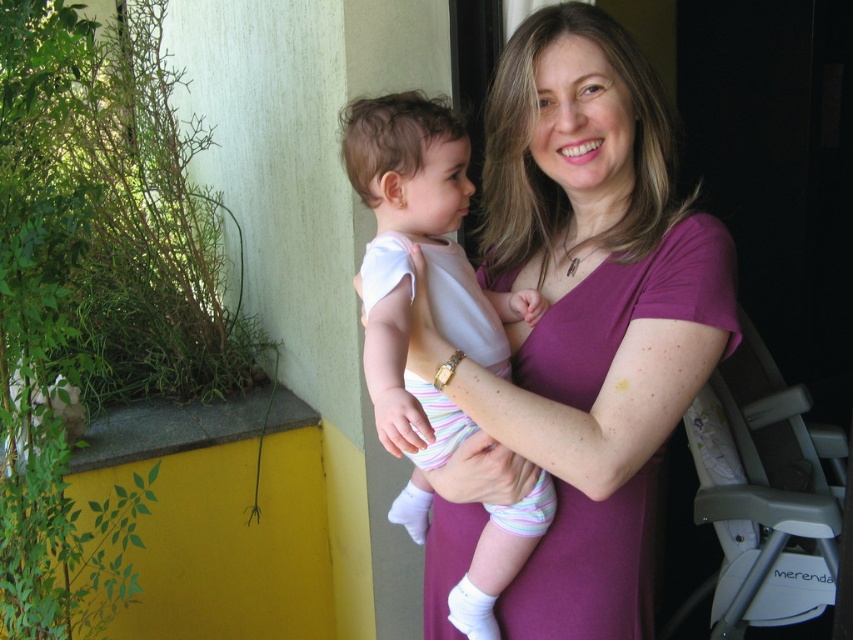
Between purple smooth shirt at center and white cotton onesie at center, which one has more height?

purple smooth shirt at center

The image size is (853, 640). Identify the location of purple smooth shirt at center. (579, 330).

Where is `purple smooth shirt at center`? The image size is (853, 640). purple smooth shirt at center is located at coordinates (579, 330).